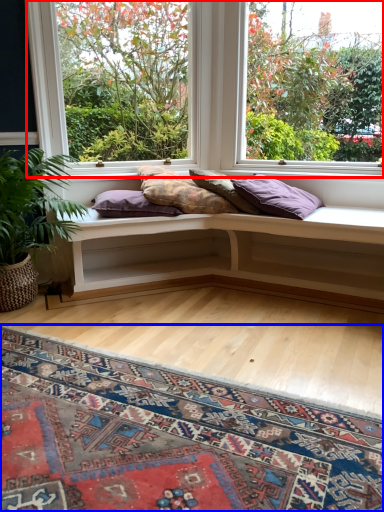
Question: Which of the following is the farthest to the observer, window (highlighted by a red box) or mat (highlighted by a blue box)?

Choices:
 (A) window
 (B) mat

Answer: (A)